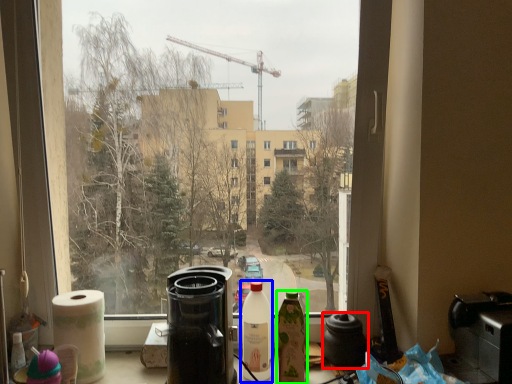
Question: Estimate the real-world distances between objects in this image. Which object is farther from coffeepot (highlighted by a red box), bottle (highlighted by a blue box) or bottle (highlighted by a green box)?

Choices:
 (A) bottle
 (B) bottle

Answer: (A)